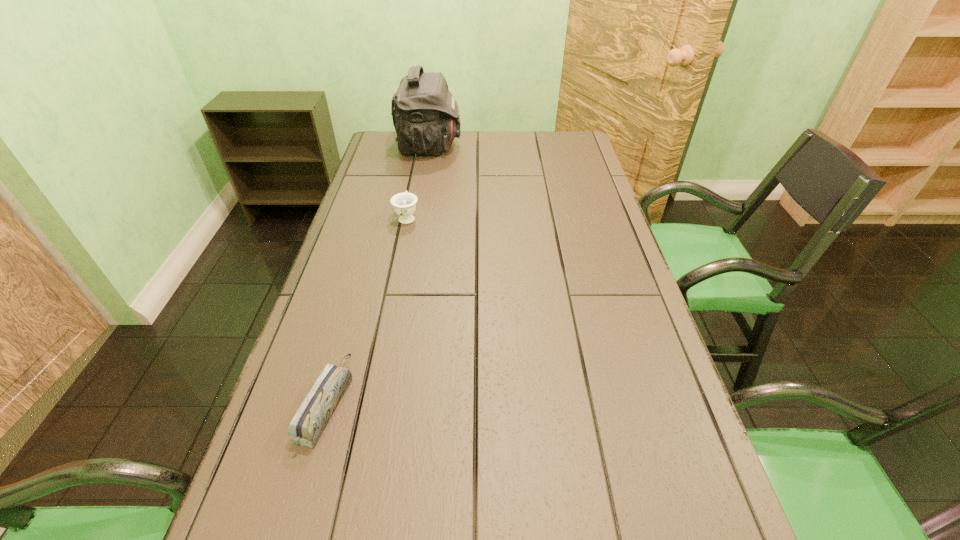
Locate an element on the screen. Image resolution: width=960 pixels, height=540 pixels. empty space that is in between the second farthest object and the farthest object is located at coordinates (418, 182).

Find the location of a particular element. The image size is (960, 540). vacant area that lies between the second farthest object and the pencil box is located at coordinates (367, 309).

Identify the location of free spot between the shoulder bag and the nearest object. pos(378,275).

Find the location of a particular element. The image size is (960, 540). vacant space in between the teacup and the shoulder bag is located at coordinates [x=418, y=182].

At what (x,y) coordinates should I click in order to perform the action: click on empty space between the second shortest object and the shoulder bag. Please return your answer as a coordinate pair (x, y). Looking at the image, I should click on (418, 182).

Point out which object is positioned as the nearest to the second shortest object. Please provide its 2D coordinates. Your answer should be formatted as a tuple, i.e. [(x, y)], where the tuple contains the x and y coordinates of a point satisfying the conditions above.

[(425, 114)]

Locate an element on the screen. object that is the closest to the second nearest object is located at coordinates 425,114.

Locate an element on the screen. free spot that satisfies the following two spatial constraints: 1. on the open flap of the shoulder bag; 2. on the front side of the pencil box is located at coordinates (383, 402).

Identify the location of free space that satisfies the following two spatial constraints: 1. on the open flap of the farthest object; 2. on the front side of the nearest object. (383, 402).